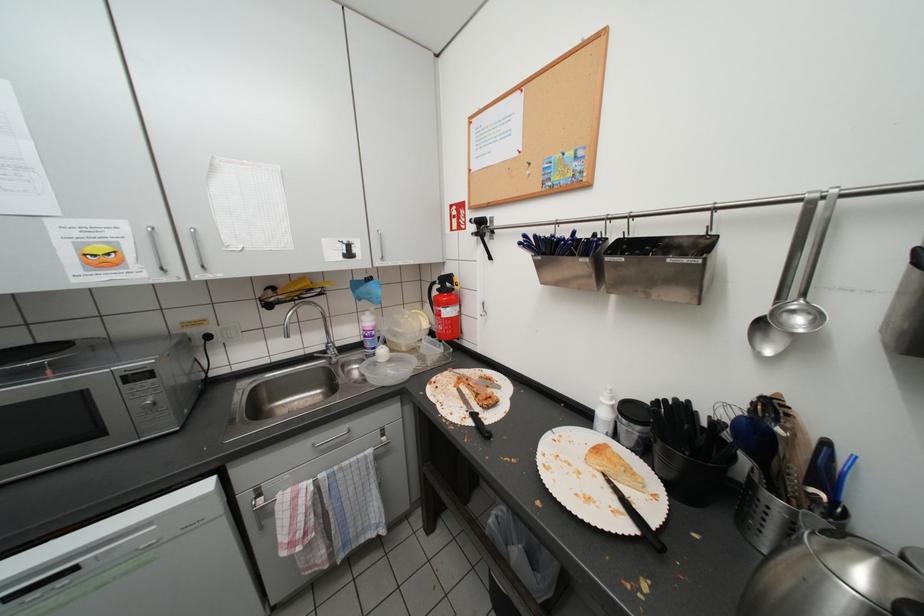
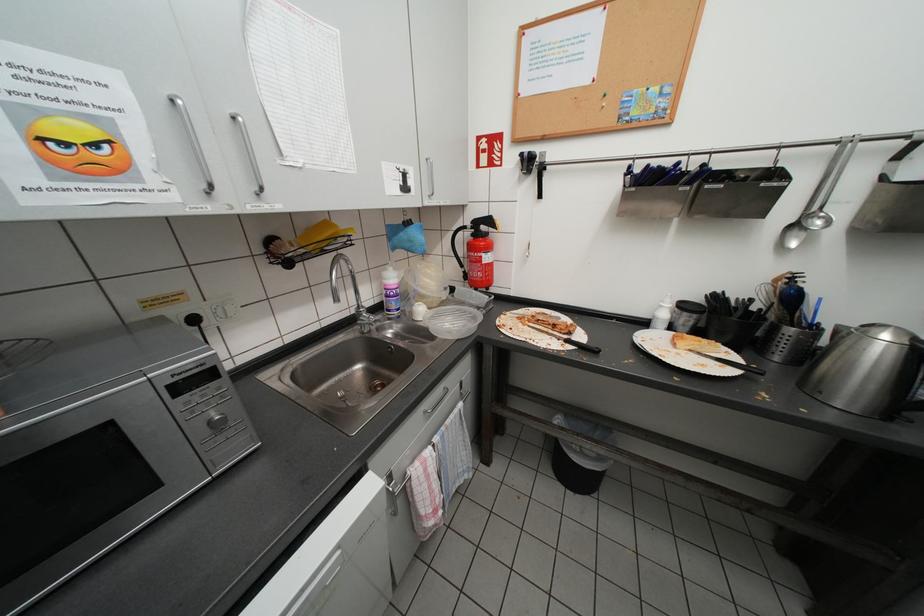
Question: The first image is from the beginning of the video and the second image is from the end. How did the camera likely rotate when shooting the video?

Choices:
 (A) Left
 (B) Right
 (C) Up
 (D) Down

Answer: (B)